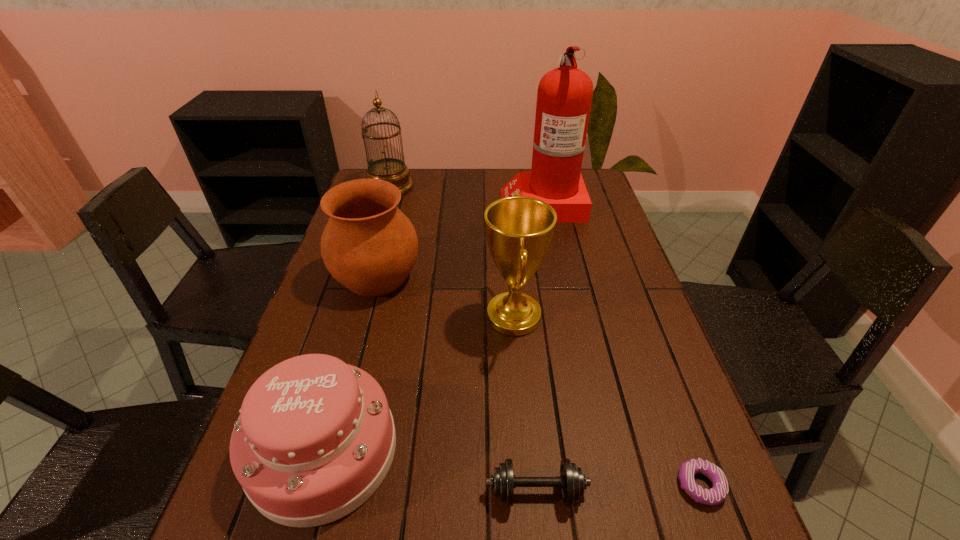
Locate an element on the screen. This screenshot has width=960, height=540. empty space that is in between the award and the birdcage is located at coordinates (451, 252).

Identify the location of free area in between the tallest object and the dumbbell. This screenshot has width=960, height=540. (540, 347).

Find the location of a particular element. vacant area that lies between the dumbbell and the shortest object is located at coordinates (618, 489).

You are a GUI agent. You are given a task and a screenshot of the screen. Output one action in this format:
    pyautogui.click(x=<x>, y=<y>)
    Task: Click on the vacant point located between the tallest object and the shortest object
    Image resolution: width=960 pixels, height=540 pixels.
    Given the screenshot: What is the action you would take?
    tap(621, 344)

You are a GUI agent. You are given a task and a screenshot of the screen. Output one action in this format:
    pyautogui.click(x=<x>, y=<y>)
    Task: Click on the blank region between the dumbbell and the pottery
    The height and width of the screenshot is (540, 960).
    Given the screenshot: What is the action you would take?
    pyautogui.click(x=456, y=384)

Find the location of a particular element. free spot between the award and the pottery is located at coordinates (445, 296).

Identify the location of vacant area between the cake and the dumbbell. The height and width of the screenshot is (540, 960). (430, 471).

Locate an element on the screen. The image size is (960, 540). empty space between the second shortest object and the tallest object is located at coordinates (540, 347).

Select which object appears as the fourth closest to the shortest object. Please provide its 2D coordinates. Your answer should be formatted as a tuple, i.e. [(x, y)], where the tuple contains the x and y coordinates of a point satisfying the conditions above.

[(369, 245)]

In order to click on object that is the second closest to the doughnut in this screenshot , I will do `click(519, 229)`.